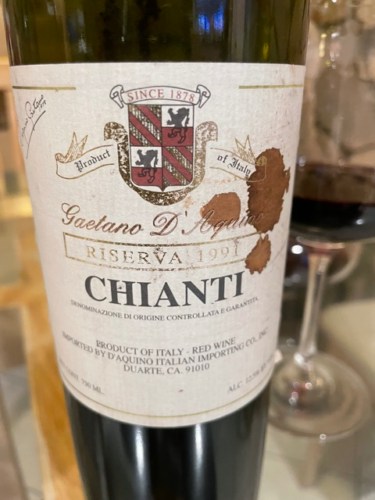
Locate an element on the screen. This screenshot has height=500, width=375. base of glass is located at coordinates (325, 405).